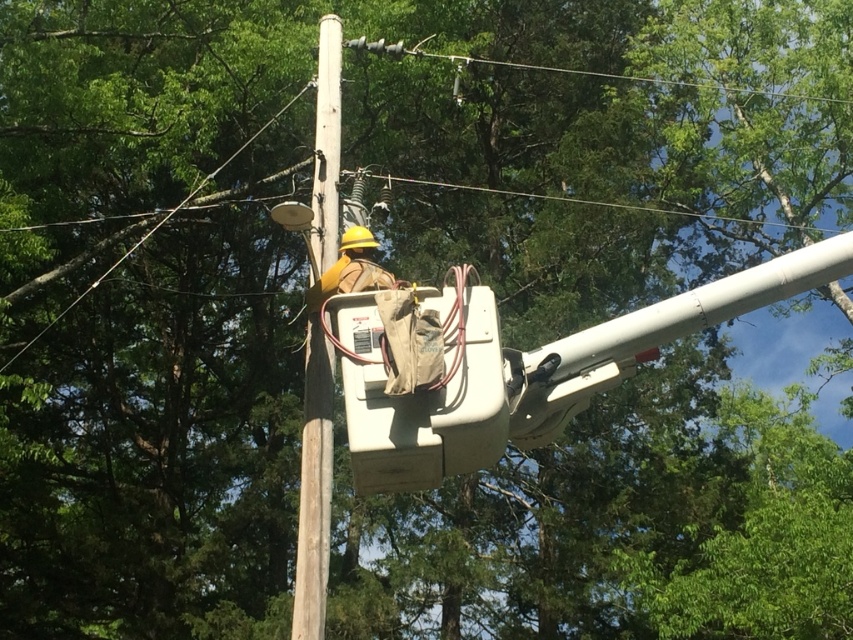
Question: Which point is closer to the camera taking this photo?

Choices:
 (A) (343, 266)
 (B) (308, 333)

Answer: (A)

Question: Does brown wooden telegraph pole at center have a lesser width compared to yellow hard hat at upper center?

Choices:
 (A) yes
 (B) no

Answer: (A)

Question: Is brown wooden telegraph pole at center further to the viewer compared to yellow hard hat at upper center?

Choices:
 (A) yes
 (B) no

Answer: (B)

Question: Which of the following is the closest to the observer?

Choices:
 (A) brown wooden telegraph pole at center
 (B) yellow hard hat at upper center

Answer: (A)

Question: Can you confirm if brown wooden telegraph pole at center is positioned to the right of yellow hard hat at upper center?

Choices:
 (A) yes
 (B) no

Answer: (B)

Question: Which point is closer to the camera taking this photo?

Choices:
 (A) (314, 362)
 (B) (364, 234)

Answer: (A)